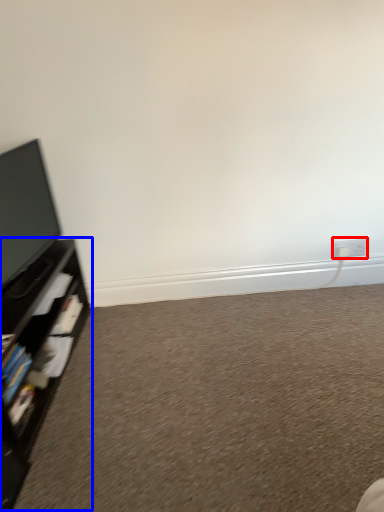
Question: Which of the following is the farthest to the observer, electric outlet (highlighted by a red box) or shelf (highlighted by a blue box)?

Choices:
 (A) electric outlet
 (B) shelf

Answer: (A)